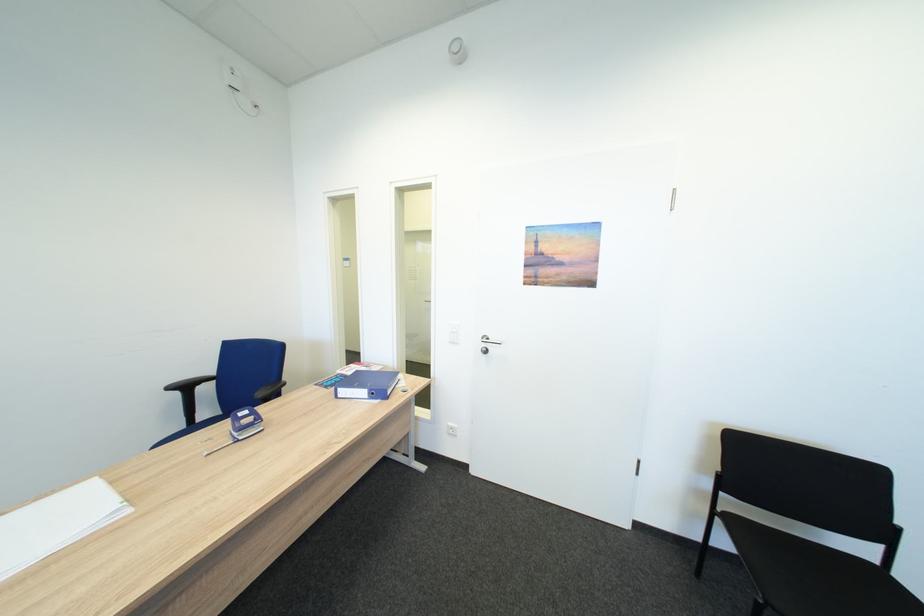
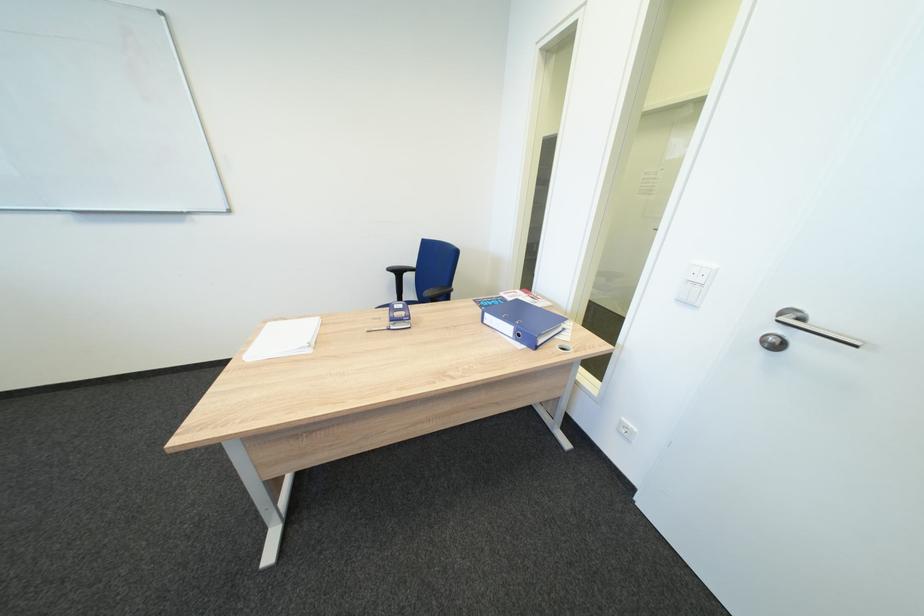
In the second image, find the point that corresponds to [181,389] in the first image.

(400, 270)